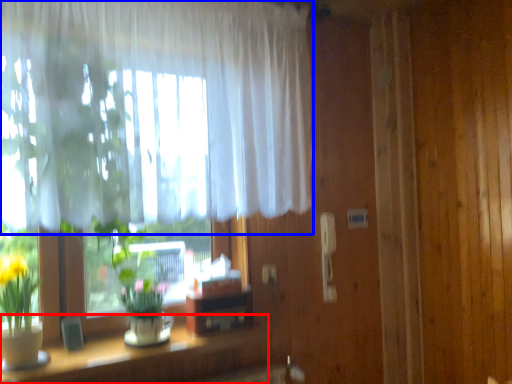
Question: Which object appears farthest to the camera in this image, table (highlighted by a red box) or curtain (highlighted by a blue box)?

Choices:
 (A) table
 (B) curtain

Answer: (A)